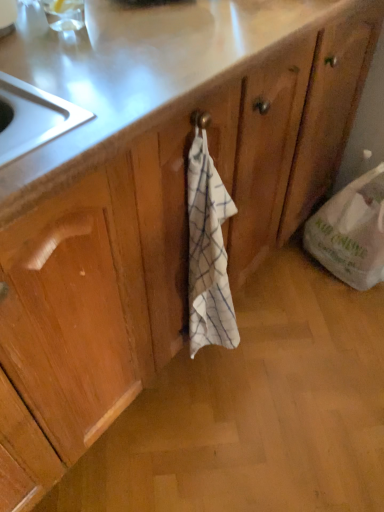
Measure the distance between white plastic bag at lower right and camera.

They are 1.32 meters apart.

Locate an element on the screen. The width and height of the screenshot is (384, 512). white plastic bag at lower right is located at coordinates (351, 232).

What is the approximate height of white plastic bag at lower right?

The height of white plastic bag at lower right is 17.11 inches.

What do you see at coordinates (351, 232) in the screenshot? I see `white plastic bag at lower right` at bounding box center [351, 232].

Where is `white plastic bag at lower right`? This screenshot has width=384, height=512. white plastic bag at lower right is located at coordinates (351, 232).